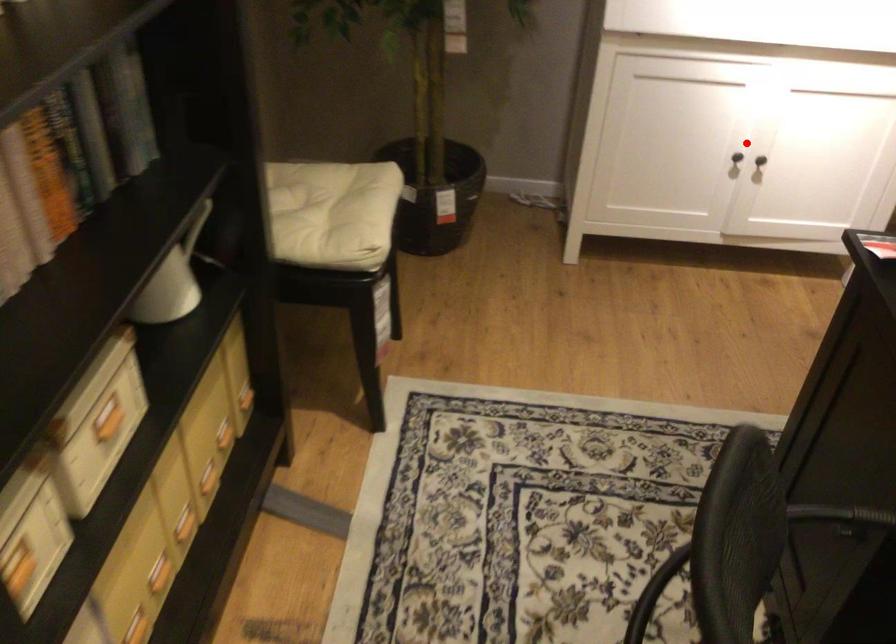
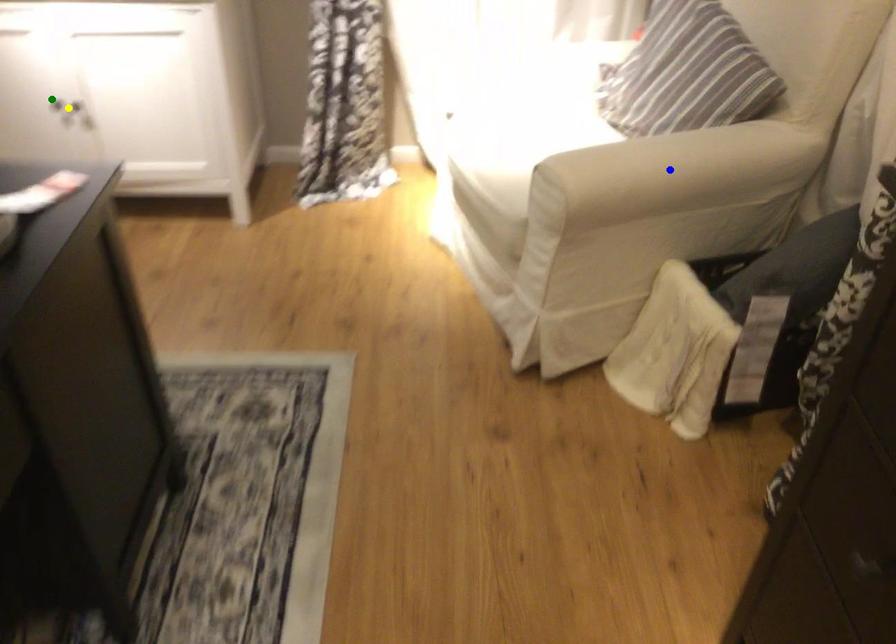
Question: I am providing you with two images of the same scene from different viewpoints. A red point is marked on the first image. You are given multiple points on the second image. Which point in image 2 represents the same 3d spot as the red point in image 1?

Choices:
 (A) green point
 (B) yellow point
 (C) blue point

Answer: (A)